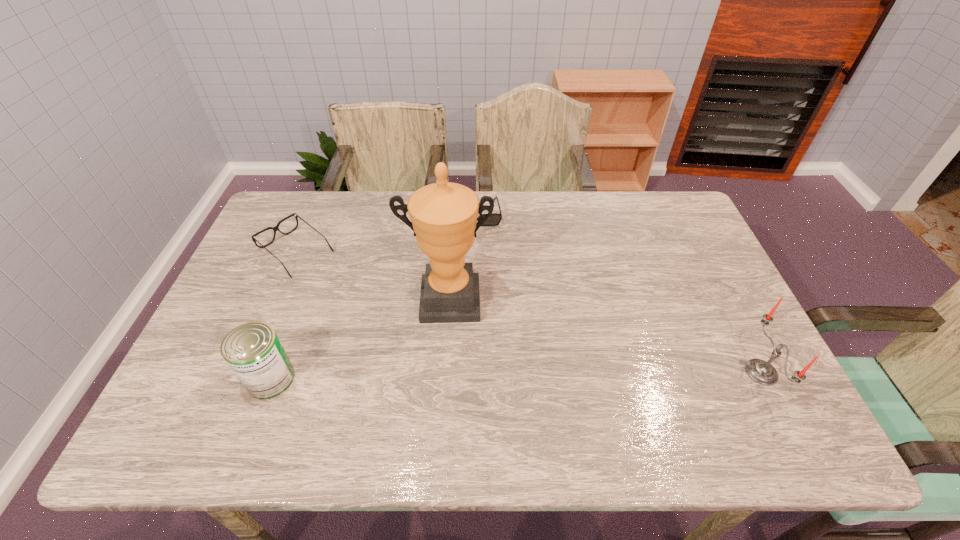
Locate an element on the screen. The width and height of the screenshot is (960, 540). free space at the left edge of the desktop is located at coordinates (257, 273).

Identify the location of free region at the right edge of the desktop. The height and width of the screenshot is (540, 960). (751, 333).

In order to click on free spot at the far left corner of the desktop in this screenshot , I will do `click(294, 224)`.

Where is `vacant region at the far right corner of the desktop`? vacant region at the far right corner of the desktop is located at coordinates (668, 199).

In the image, there is a desktop. Where is `vacant space at the near right corner`? The width and height of the screenshot is (960, 540). vacant space at the near right corner is located at coordinates (735, 405).

What are the coordinates of `free space that is in between the award and the spectacles` in the screenshot? It's located at [x=372, y=276].

What are the coordinates of `free space between the can and the sunglasses` in the screenshot? It's located at (372, 296).

Identify the location of free space between the rightmost object and the can. (516, 375).

Where is `empty space that is in between the third tallest object and the spectacles`? Image resolution: width=960 pixels, height=540 pixels. empty space that is in between the third tallest object and the spectacles is located at coordinates tap(283, 315).

You are a GUI agent. You are given a task and a screenshot of the screen. Output one action in this format:
    pyautogui.click(x=<x>, y=<y>)
    Task: Click on the free space between the sunglasses and the rightmost object
    The image size is (960, 540).
    Given the screenshot: What is the action you would take?
    pyautogui.click(x=618, y=293)